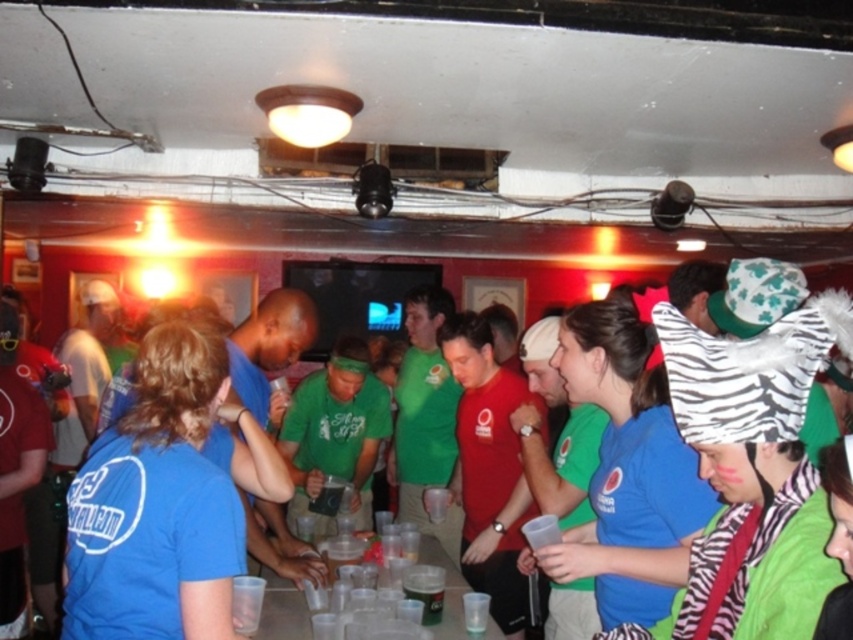
You are at a party and see a blue fabric shirt at center and a black plastic cup at center. Which object is positioned to the right of the other?

The blue fabric shirt at center is to the right of the black plastic cup at center.

You are at a party and need to determine which item is bigger between the blue fabric shirt at center and the black plastic cup at center. Which one is larger?

The blue fabric shirt at center is larger than the black plastic cup at center according to the description.

You are at a party and see a blue fabric shirt at center and a black plastic cup at center. Which object is closer to you?

The blue fabric shirt at center is closer to you because it is positioned over the black plastic cup at center.